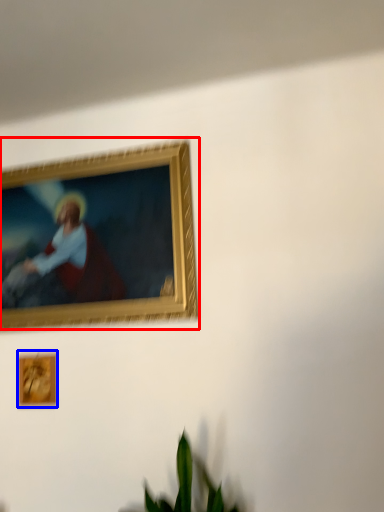
Question: Among these objects, which one is nearest to the camera, picture frame (highlighted by a red box) or picture frame (highlighted by a blue box)?

Choices:
 (A) picture frame
 (B) picture frame

Answer: (A)